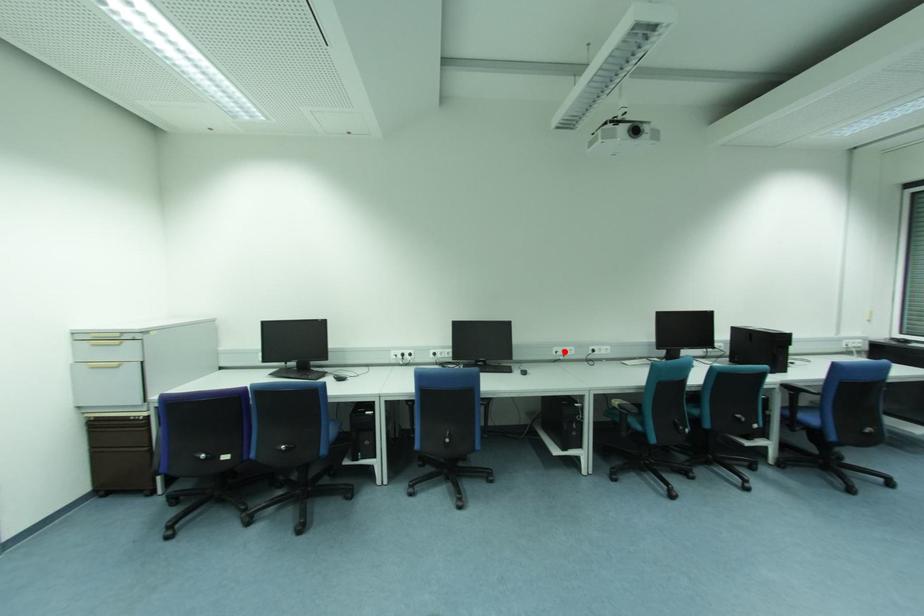
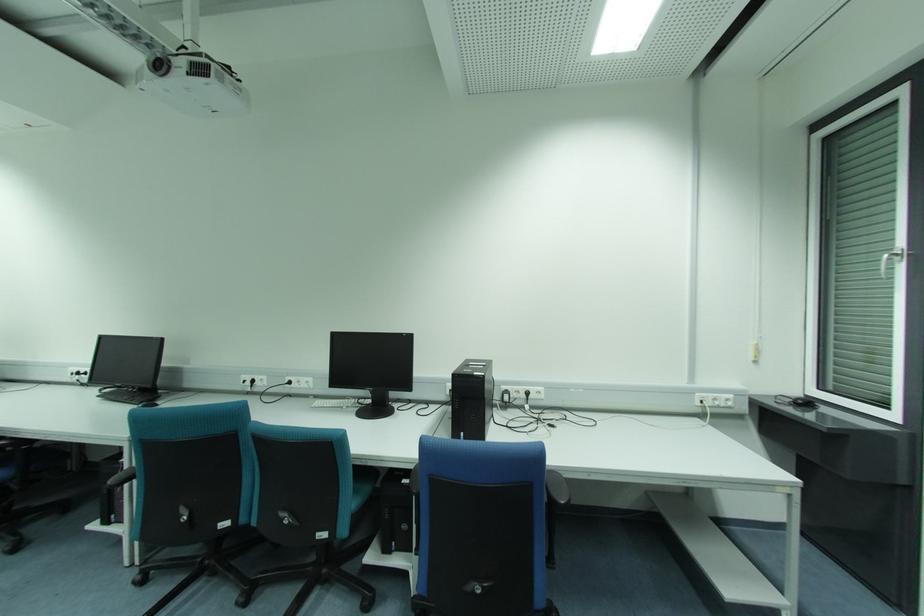
In the second image, find the point that corresponds to the highlighted location in the first image.

(253, 381)